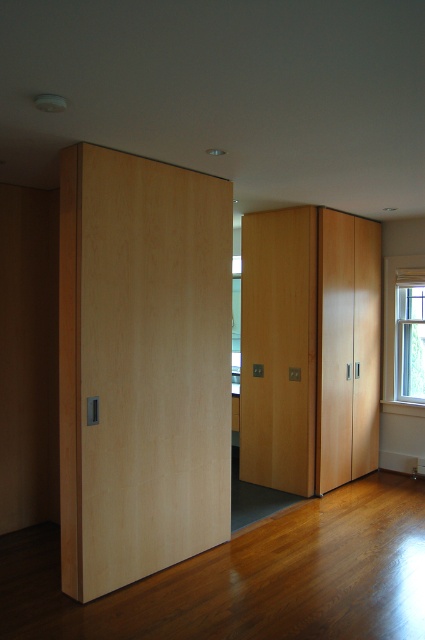
Is point (252, 333) positioned behind point (421, 339)?

No.

Does light wood door at center have a lesser width compared to clear glass window at right?

Incorrect, light wood door at center's width is not less than clear glass window at right's.

What do you see at coordinates (278, 348) in the screenshot? I see `light wood door at center` at bounding box center [278, 348].

This screenshot has height=640, width=425. I want to click on light wood door at center, so click(x=278, y=348).

Does light wood/veneer door at left appear under clear glass window at right?

Yes.

Can you confirm if light wood/veneer door at left is smaller than clear glass window at right?

No.

The width and height of the screenshot is (425, 640). I want to click on light wood/veneer door at left, so click(150, 365).

Find the location of `light wood/veneer door at left`. light wood/veneer door at left is located at coordinates 150,365.

Between point (113, 356) and point (342, 257), which one is positioned behind?

The point (342, 257) is more distant.

Can you confirm if light wood/veneer door at left is bigger than matte wood cabinet at center?

Correct, light wood/veneer door at left is larger in size than matte wood cabinet at center.

Based on the photo, who is more forward, (93, 424) or (362, 253)?

Positioned in front is point (93, 424).

This screenshot has width=425, height=640. Find the location of `light wood/veneer door at left`. light wood/veneer door at left is located at coordinates (150, 365).